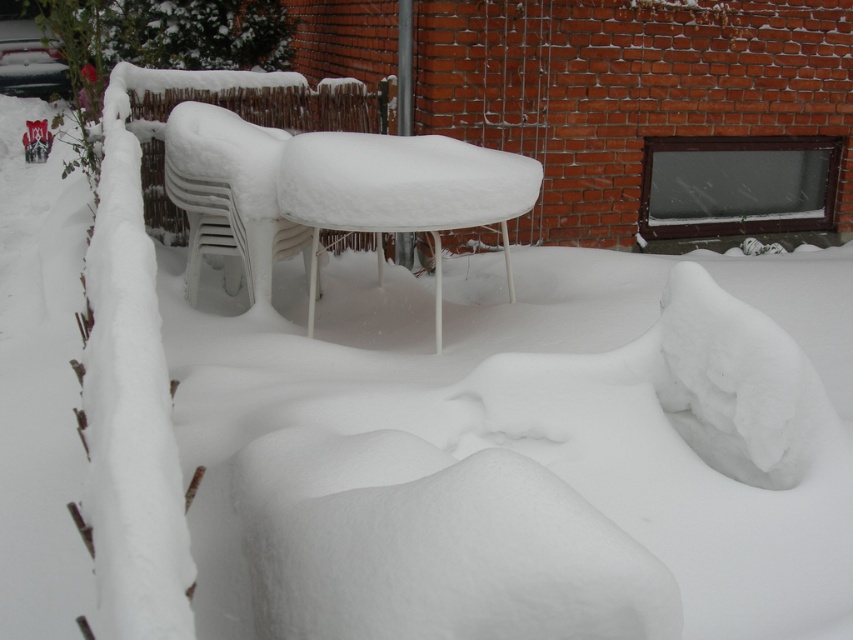
Which is in front, point (321, 177) or point (268, 252)?

Point (321, 177) is in front.

Between white plastic table at center and white plastic chair at center, which one is positioned higher?

white plastic chair at center

The height and width of the screenshot is (640, 853). Describe the element at coordinates (401, 192) in the screenshot. I see `white plastic table at center` at that location.

The width and height of the screenshot is (853, 640). Identify the location of white plastic table at center. coord(401,192).